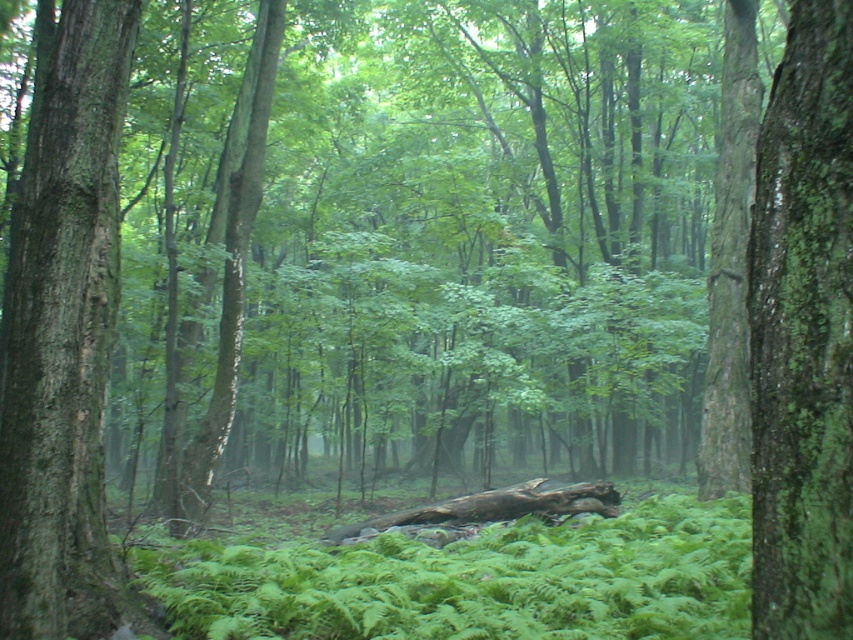
Is smooth bark tree trunk at left bigger than brown rough log at center?

No, smooth bark tree trunk at left is not bigger than brown rough log at center.

Does point (24, 180) come behind point (456, 504)?

No, it is in front of (456, 504).

Who is more distant from viewer, (85, 461) or (527, 499)?

Positioned behind is point (527, 499).

You are a GUI agent. You are given a task and a screenshot of the screen. Output one action in this format:
    pyautogui.click(x=<x>, y=<y>)
    Task: Click on the smooth bark tree trunk at left
    The image size is (853, 640).
    Given the screenshot: What is the action you would take?
    pyautogui.click(x=64, y=339)

Who is more forward, (843,182) or (408,520)?

Positioned in front is point (843,182).

Between green mossy bark tree trunk at right and brown rough log at center, which one is positioned higher?

green mossy bark tree trunk at right

Who is more forward, (836, 97) or (483, 516)?

Point (836, 97) is in front.

Locate an element on the screen. This screenshot has height=640, width=853. green mossy bark tree trunk at right is located at coordinates (804, 333).

Is smooth bark tree trunk at left to the right of green mossy bark tree trunk at right from the viewer's perspective?

In fact, smooth bark tree trunk at left is to the left of green mossy bark tree trunk at right.

Does smooth bark tree trunk at left appear under green mossy bark tree trunk at right?

Incorrect, smooth bark tree trunk at left is not positioned below green mossy bark tree trunk at right.

Between point (4, 481) and point (780, 67), which one is positioned in front?

Positioned in front is point (780, 67).

Locate an element on the screen. The image size is (853, 640). smooth bark tree trunk at left is located at coordinates (64, 339).